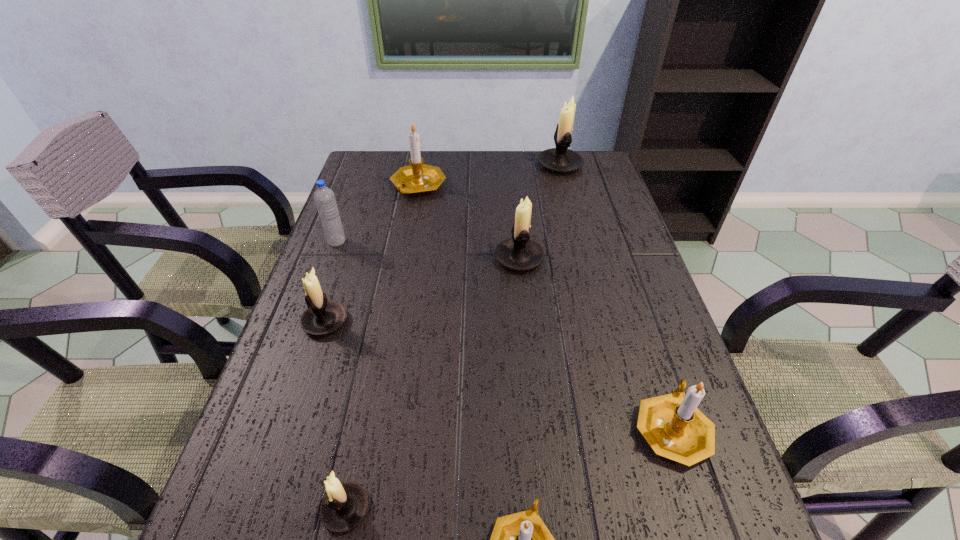
Find the location of `the farthest white candle holder`. the farthest white candle holder is located at coordinates (560, 159).

Where is `the tallest candle holder`? The height and width of the screenshot is (540, 960). the tallest candle holder is located at coordinates pos(560,159).

Find the location of a particular element. The height and width of the screenshot is (540, 960). the farthest gold candle holder is located at coordinates tap(417, 178).

I want to click on the leftmost gold candle holder, so click(x=417, y=178).

This screenshot has height=540, width=960. Find the location of `the third white candle holder from left to right`. the third white candle holder from left to right is located at coordinates (520, 253).

This screenshot has width=960, height=540. I want to click on the second farthest white candle holder, so click(520, 253).

Find the location of a particular element. blue water bottle is located at coordinates (324, 197).

Locate an element on the screen. Image resolution: width=960 pixels, height=540 pixels. the rightmost gold candle holder is located at coordinates (672, 425).

You are a GUI agent. You are given a task and a screenshot of the screen. Output one action in this format:
    pyautogui.click(x=<x>, y=<y>)
    Task: Click on the second nearest gold candle holder
    
    Given the screenshot: What is the action you would take?
    pyautogui.click(x=672, y=425)

This screenshot has width=960, height=540. In order to click on the leftmost candle holder in this screenshot , I will do [323, 316].